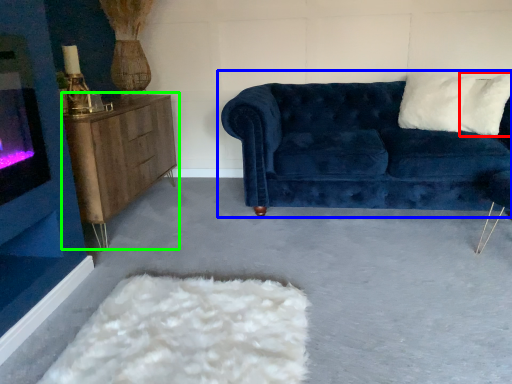
Question: Estimate the real-world distances between objects in this image. Which object is closer to pillow (highlighted by a red box), studio couch (highlighted by a blue box) or table (highlighted by a green box)?

Choices:
 (A) studio couch
 (B) table

Answer: (A)